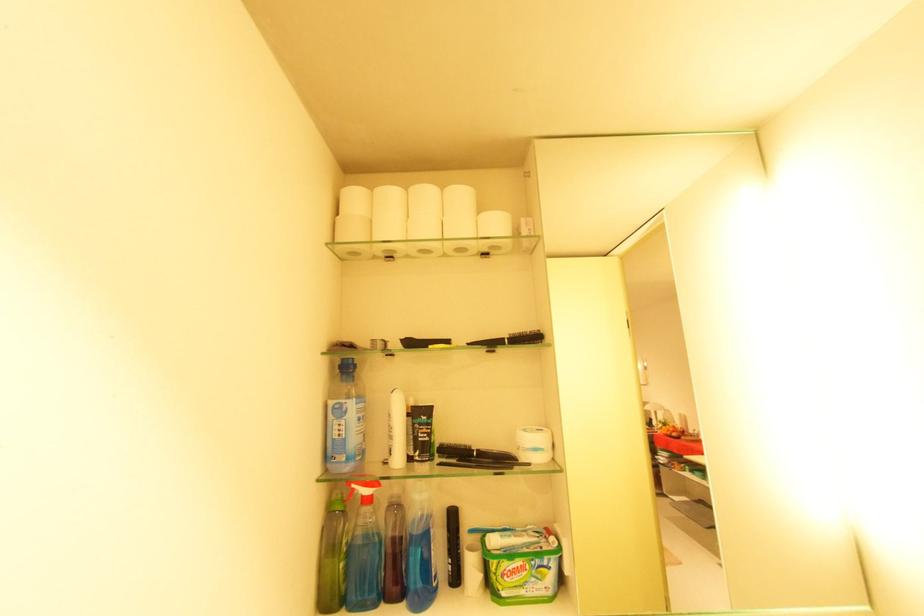
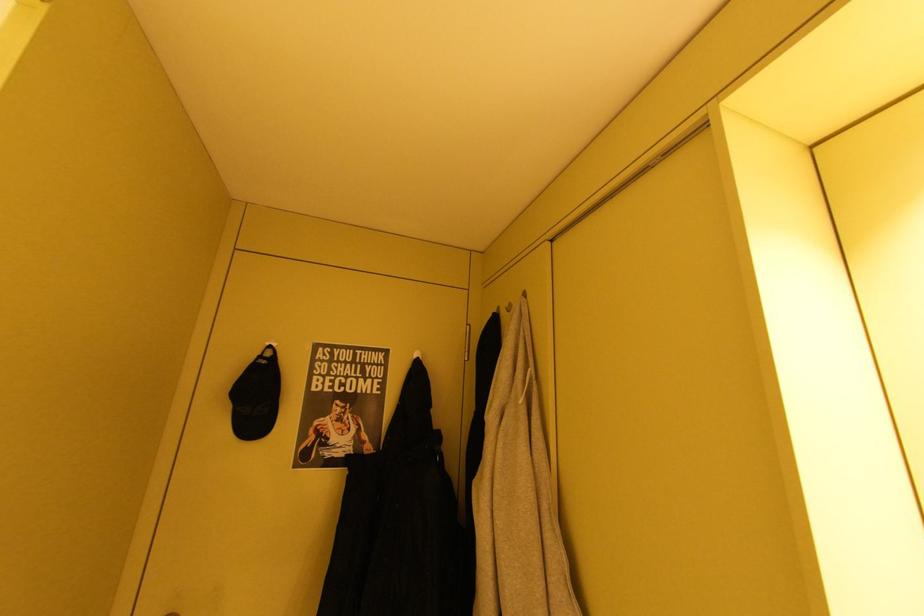
Question: Which direction would the cameraman need to move to produce the second image? Reply with the corresponding letter.

Choices:
 (A) Left
 (B) Right
 (C) Forward
 (D) Backward

Answer: (B)